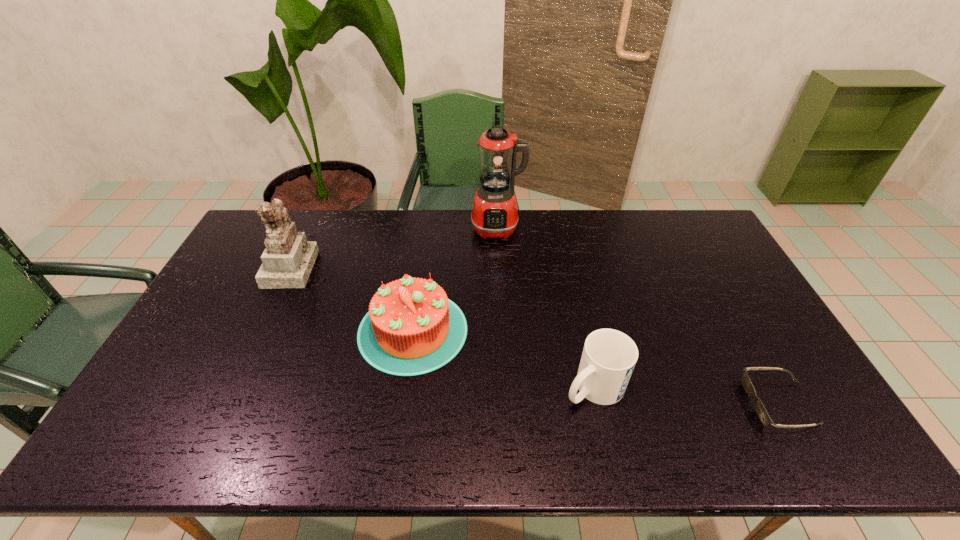
Find the location of `the farthest object`. the farthest object is located at coordinates (494, 214).

At what (x,y) coordinates should I click in order to perform the action: click on the tallest object. Please return your answer as a coordinate pair (x, y). Image resolution: width=960 pixels, height=540 pixels. Looking at the image, I should click on (494, 214).

The height and width of the screenshot is (540, 960). What are the coordinates of `the fourth nearest object` in the screenshot? It's located at (287, 261).

The image size is (960, 540). Identify the location of the second tallest object. (287, 261).

Where is `the fourth object from right to left`? This screenshot has height=540, width=960. the fourth object from right to left is located at coordinates [x=412, y=328].

The image size is (960, 540). In order to click on cake in this screenshot , I will do `click(412, 328)`.

Where is `the second shortest object`? The image size is (960, 540). the second shortest object is located at coordinates (609, 356).

Find the location of a particular element. The image size is (960, 540). mug is located at coordinates (609, 356).

Locate an element on the screen. the rightmost object is located at coordinates [x=761, y=411].

The height and width of the screenshot is (540, 960). I want to click on the shortest object, so click(761, 411).